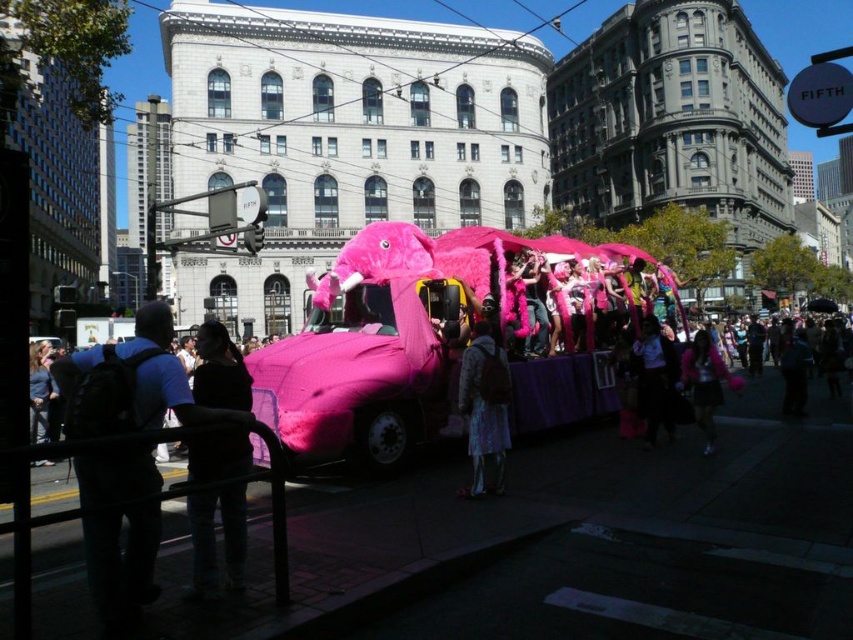
Is point (476, 387) behind point (743, 381)?

That is False.

Is fluffy pink coat at center wider than pink fluffy jacket at lower right?

No, fluffy pink coat at center is not wider than pink fluffy jacket at lower right.

Who is more distant from viewer, (502, 371) or (712, 410)?

The point (712, 410) is more distant.

You are a GUI agent. You are given a task and a screenshot of the screen. Output one action in this format:
    pyautogui.click(x=<x>, y=<y>)
    Task: Click on the fluffy pink coat at center
    This screenshot has height=640, width=853.
    Given the screenshot: What is the action you would take?
    pyautogui.click(x=485, y=406)

The image size is (853, 640). What do you see at coordinates (132, 381) in the screenshot?
I see `dark blue backpack at left` at bounding box center [132, 381].

Image resolution: width=853 pixels, height=640 pixels. Identify the location of dark blue backpack at left. (132, 381).

Is point (137, 424) positioned in front of point (483, 320)?

Yes.

Identify the location of dark blue backpack at left. (132, 381).

Find the location of a particular element. Image resolution: width=853 pixels, height=640 pixels. dark blue backpack at left is located at coordinates (132, 381).